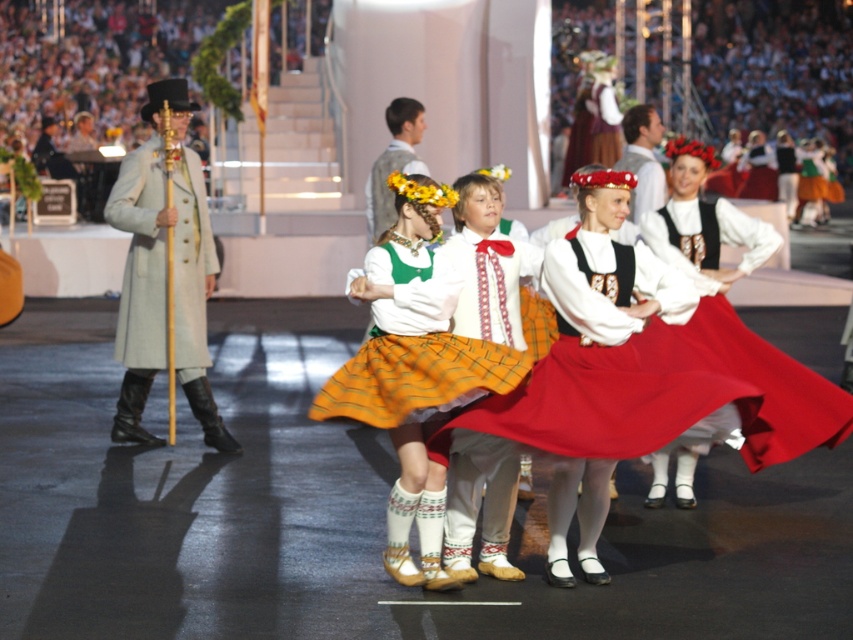
You are a photographer standing at the back of the venue. You want to capture a photo of both the matte yellow skirt at center and the light beige wool coat at left in the same frame. The camera you have can focus on objects within a 4 meter range. Can you take the photo without moving your position?

The distance between the matte yellow skirt at center and the light beige wool coat at left is 3.37 meters, which is within the camera focus range of 4 meters. Therefore, you can take the photo without moving your position.

From the picture: What is the position of the light beige wool coat at left in the image?

The light beige wool coat at left is located at point 0.405 on the x axis and 0.166 on the y axis.